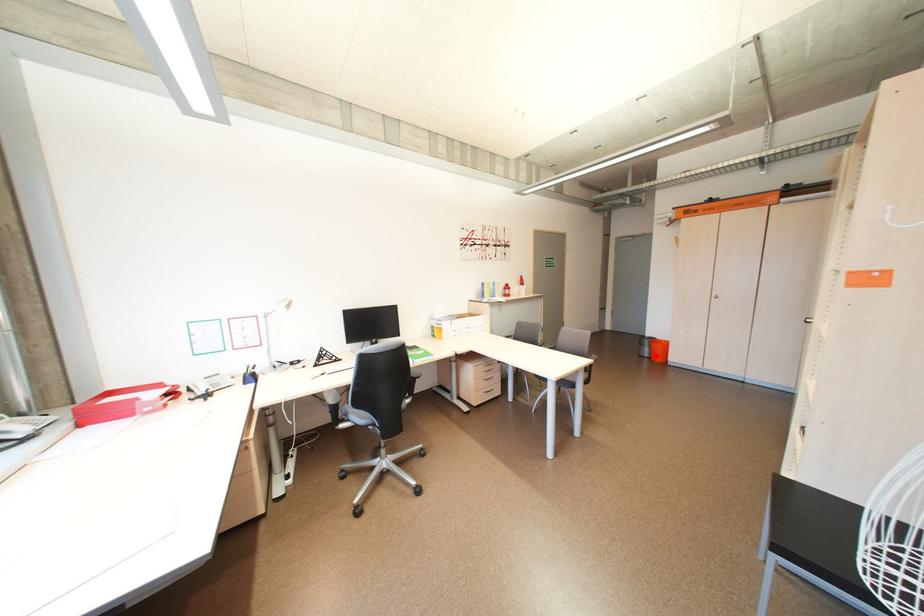
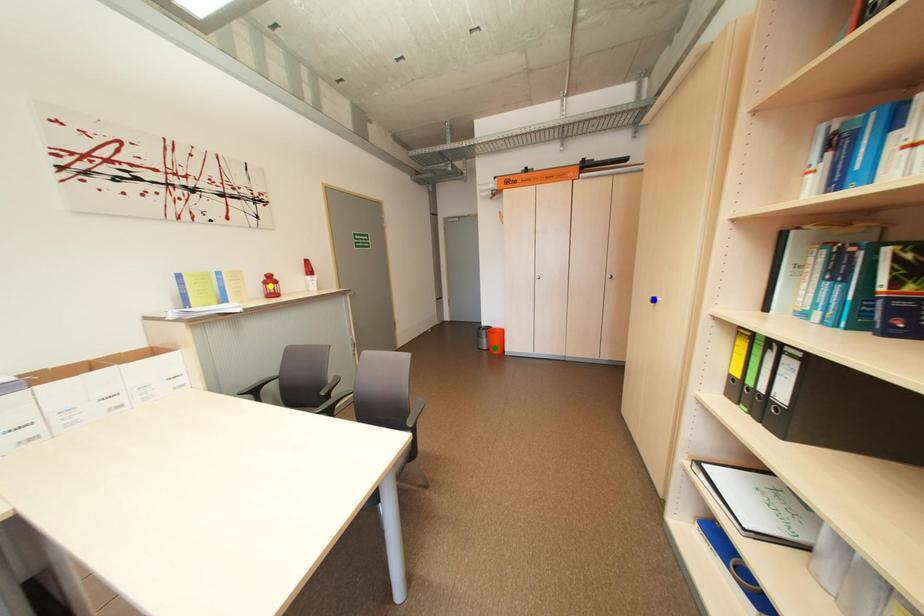
Question: I am providing you with two images of the same scene from different viewpoints. A red point is marked on the first image. You are given multiple points on the second image. Which mark in image 2 goes with the point in image 1?

Choices:
 (A) yellow point
 (B) blue point
 (C) green point

Answer: (C)